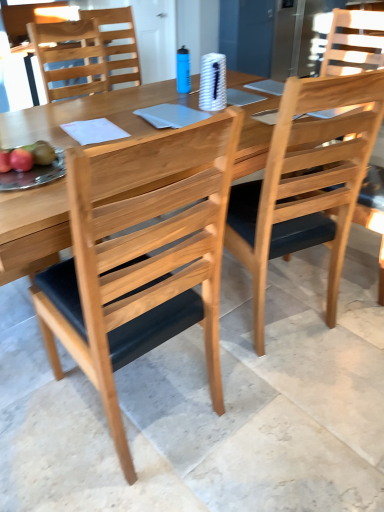
Locate an element on the screen. free space on the front side of shiny red apple at left, the first fruit in the back-to-front sequence is located at coordinates (35, 188).